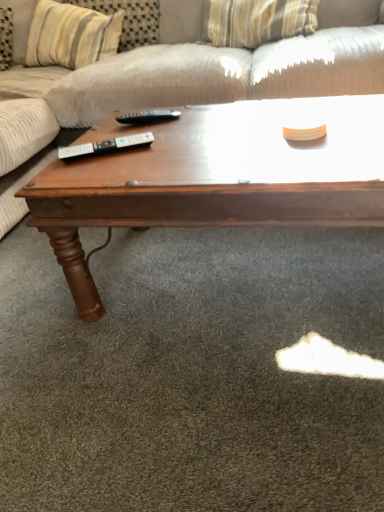
This screenshot has height=512, width=384. What are the coordinates of `vacant area located to the right-hand side of black plastic remote at center, which ranks as the second remote in back-to-front order` in the screenshot? It's located at (177, 143).